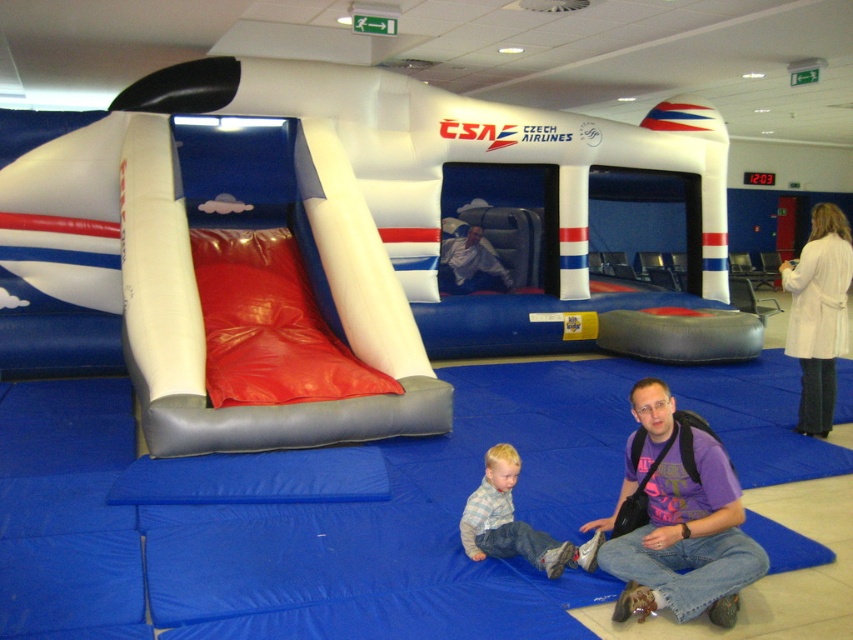
Question: Can you confirm if white inflatable slide at center is wider than white fabric man at center?

Choices:
 (A) no
 (B) yes

Answer: (A)

Question: Considering the relative positions of white inflatable slide at center and white wool coat at upper right in the image provided, where is white inflatable slide at center located with respect to white wool coat at upper right?

Choices:
 (A) above
 (B) below

Answer: (B)

Question: Which point is closer to the camera?

Choices:
 (A) (486, 252)
 (B) (830, 236)

Answer: (B)

Question: Which is nearer to the white fabric man at center?

Choices:
 (A) white wool coat at upper right
 (B) purple cotton t-shirt at lower center

Answer: (A)

Question: Estimate the real-world distances between objects in this image. Which object is closer to the white inflatable slide at center?

Choices:
 (A) white wool coat at upper right
 (B) purple cotton t-shirt at lower center
 (C) white fabric man at center
 (D) light blue denim jeans at lower center

Answer: (D)

Question: Is light blue denim jeans at lower center positioned in front of white fabric man at center?

Choices:
 (A) no
 (B) yes

Answer: (B)